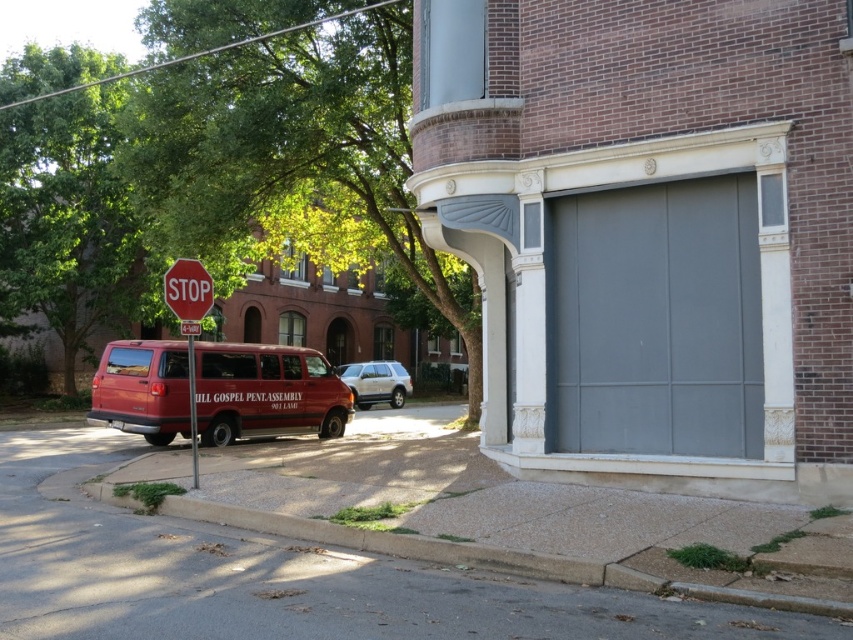
Question: Which object appears farthest from the camera in this image?

Choices:
 (A) silver metallic suv at center
 (B) red plastic stop sign at upper left
 (C) matte red van at lower left
 (D) red matte stop sign at left

Answer: (A)

Question: Which point is farther to the camera?

Choices:
 (A) (169, 275)
 (B) (402, 380)
 (C) (761, 336)

Answer: (B)

Question: Can you confirm if gray matte/glossy garage door at center is positioned below red plastic stop sign at upper left?

Choices:
 (A) no
 (B) yes

Answer: (A)

Question: Is gray concrete pavement at lower left smaller than red matte stop sign at left?

Choices:
 (A) no
 (B) yes

Answer: (A)

Question: Which point is closer to the camera?

Choices:
 (A) (656, 628)
 (B) (173, 282)
 (C) (363, 394)

Answer: (A)

Question: Is gray matte/glossy garage door at center positioned at the back of red matte stop sign at left?

Choices:
 (A) yes
 (B) no

Answer: (B)